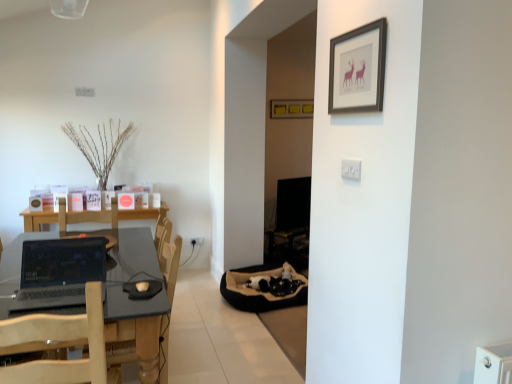
Identify the location of wooden armchair at center. The image size is (512, 384). (140, 345).

What do you see at coordinates (358, 69) in the screenshot? The width and height of the screenshot is (512, 384). I see `matte black picture frame at upper center, the 2th picture frame viewed from the top` at bounding box center [358, 69].

The image size is (512, 384). What do you see at coordinates (59, 272) in the screenshot?
I see `black glossy laptop at left` at bounding box center [59, 272].

The width and height of the screenshot is (512, 384). Describe the element at coordinates (293, 204) in the screenshot. I see `black glossy monitor at center` at that location.

This screenshot has height=384, width=512. Find the location of `wooden armchair at center`. wooden armchair at center is located at coordinates (x=140, y=345).

Consider the image. How many degrees apart are the facing directions of wooden armchair at center and wooden chair at left?

The angle between the facing direction of wooden armchair at center and the facing direction of wooden chair at left is 95.2 degrees.

From the image's perspective, which one is positioned lower, wooden armchair at center or wooden chair at left?

wooden armchair at center appears lower in the image.

Can you confirm if wooden armchair at center is thinner than wooden chair at left?

Incorrect, the width of wooden armchair at center is not less than that of wooden chair at left.

Which object is positioned more to the left, wooden chair at left or black glossy monitor at center?

From the viewer's perspective, wooden chair at left appears more on the left side.

Based on their sizes in the image, would you say wooden chair at left is bigger or smaller than black glossy monitor at center?

wooden chair at left is bigger than black glossy monitor at center.

Locate an element on the screen. This screenshot has width=512, height=384. computer monitor located on the right of wooden chair at left is located at coordinates (293, 204).

Considering the sizes of black glossy laptop at left and matte yellow picture frame at center, arranged as the second picture frame when ordered from the bottom, in the image, is black glossy laptop at left wider or thinner than matte yellow picture frame at center, arranged as the second picture frame when ordered from the bottom,?

Considering their sizes, black glossy laptop at left looks broader than matte yellow picture frame at center, arranged as the second picture frame when ordered from the bottom.

Consider the image. Is black glossy laptop at left positioned with its back to matte yellow picture frame at center, arranged as the second picture frame when ordered from the bottom?

No.

How different are the orientations of black glossy laptop at left and matte yellow picture frame at center, the 1th picture frame viewed from the top, in degrees?

black glossy laptop at left and matte yellow picture frame at center, the 1th picture frame viewed from the top, are facing 3.95 degrees away from each other.

From a real-world perspective, does black glossy laptop at left stand above matte yellow picture frame at center, the 1th picture frame viewed from the top?

No.

Relative to dark gray laminate table at left, is black glossy monitor at center in front or behind?

Clearly, black glossy monitor at center is behind dark gray laminate table at left.

Where is `computer monitor behind the dark gray laminate table at left`? computer monitor behind the dark gray laminate table at left is located at coordinates (293, 204).

Is black glossy monitor at center facing away from dark gray laminate table at left?

No.

Is point (166, 370) behind point (349, 179)?

That is True.

Based on the photo, which object is wider, wooden armchair at center or white plastic electric outlet at upper center, placed as the second electric outlet when sorted from left to right?

Wider between the two is wooden armchair at center.

Can you confirm if wooden armchair at center is taller than white plastic electric outlet at upper center, the first electric outlet when ordered from front to back?

Yes.

Which is behind, black glossy monitor at center or wooden armchair at center?

black glossy monitor at center is further from the camera.

Between black glossy monitor at center and wooden armchair at center, which one has smaller width?

Thinner between the two is black glossy monitor at center.

Can you confirm if black glossy monitor at center is smaller than wooden armchair at center?

Indeed, black glossy monitor at center has a smaller size compared to wooden armchair at center.

Locate an element on the screen. The width and height of the screenshot is (512, 384). armchair below the black glossy monitor at center (from a real-world perspective) is located at coordinates (140, 345).

Does dark gray laminate table at left turn towards black glossy monitor at center?

No.

Locate an element on the screen. The width and height of the screenshot is (512, 384). table on the left of black glossy monitor at center is located at coordinates (136, 304).

From the image's perspective, between dark gray laminate table at left and black glossy monitor at center, which one is located above?

black glossy monitor at center.

Considering the relative sizes of dark gray laminate table at left and black glossy monitor at center in the image provided, is dark gray laminate table at left wider than black glossy monitor at center?

Yes, dark gray laminate table at left is wider than black glossy monitor at center.

Where is `chair that appears above the wooden armchair at center (from a real-world perspective)`? This screenshot has width=512, height=384. chair that appears above the wooden armchair at center (from a real-world perspective) is located at coordinates (60, 341).

Identify the location of computer monitor on the right of wooden chair at left. This screenshot has width=512, height=384. (293, 204).

Estimate the real-world distances between objects in this image. Which object is closer to white plastic electric outlet at upper center, which ranks as the first electric outlet in right-to-left order, white plastic electric outlet at center, acting as the 2th electric outlet starting from the top, or matte yellow picture frame at center, arranged as the second picture frame when ordered from the bottom?

Among the two, white plastic electric outlet at center, acting as the 2th electric outlet starting from the top, is located nearer to white plastic electric outlet at upper center, which ranks as the first electric outlet in right-to-left order.

Looking at the image, which one is located closer to black glossy laptop at left, white plastic electric outlet at upper center, which ranks as the second electric outlet in back-to-front order, or matte black picture frame at upper center, the 1th picture frame ordered from the bottom?

Based on the image, white plastic electric outlet at upper center, which ranks as the second electric outlet in back-to-front order, appears to be nearer to black glossy laptop at left.

Which object lies nearer to the anchor point wooden chair at left, white plastic electric outlet at upper center, which ranks as the second electric outlet in back-to-front order, or matte black picture frame at upper center, arranged as the first picture frame when viewed from the front?

Based on the image, white plastic electric outlet at upper center, which ranks as the second electric outlet in back-to-front order, appears to be nearer to wooden chair at left.

Which object lies nearer to the anchor point dark gray laminate table at left, matte yellow picture frame at center, arranged as the 2th picture frame when viewed from the front, or white plastic electric outlet at upper center, marked as the 1th electric outlet in a top-to-bottom arrangement?

Based on the image, white plastic electric outlet at upper center, marked as the 1th electric outlet in a top-to-bottom arrangement, appears to be nearer to dark gray laminate table at left.

From the image, which object appears to be nearer to matte black picture frame at upper center, arranged as the second picture frame when viewed from the back, wooden armchair at center or white plastic electric outlet at center, placed as the 1th electric outlet when sorted from bottom to top?

Among the two, wooden armchair at center is located nearer to matte black picture frame at upper center, arranged as the second picture frame when viewed from the back.

When comparing their distances from white plastic electric outlet at upper center, the first electric outlet when ordered from front to back, does matte yellow picture frame at center, the 1th picture frame viewed from the top, or black glossy laptop at left seem further?

The object further to white plastic electric outlet at upper center, the first electric outlet when ordered from front to back, is matte yellow picture frame at center, the 1th picture frame viewed from the top.

From the image, which object appears to be farther from matte black picture frame at upper center, the 1th picture frame ordered from the bottom, white plastic electric outlet at upper center, which ranks as the second electric outlet in back-to-front order, or wooden armchair at center?

Among the two, wooden armchair at center is located further to matte black picture frame at upper center, the 1th picture frame ordered from the bottom.

Looking at this image, from the image, which object appears to be farther from wooden armchair at center, black glossy laptop at left or black glossy monitor at center?

black glossy monitor at center is further to wooden armchair at center.

This screenshot has width=512, height=384. I want to click on electric outlet located between wooden chair at left and white plastic electric outlet at center, which is the second electric outlet in right-to-left order, in the depth direction, so click(x=351, y=169).

The height and width of the screenshot is (384, 512). In order to click on armchair between dark gray laminate table at left and white plastic electric outlet at upper center, marked as the 2th electric outlet in a bottom-to-top arrangement, in the horizontal direction in this screenshot , I will do `click(140, 345)`.

Where is `armchair between white plastic electric outlet at upper center, placed as the second electric outlet when sorted from left to right, and black glossy monitor at center, along the z-axis`? This screenshot has height=384, width=512. armchair between white plastic electric outlet at upper center, placed as the second electric outlet when sorted from left to right, and black glossy monitor at center, along the z-axis is located at coordinates (140, 345).

You are a GUI agent. You are given a task and a screenshot of the screen. Output one action in this format:
    pyautogui.click(x=<x>, y=<y>)
    Task: Click on the armchair between dark gray laminate table at left and matte yellow picture frame at center, acting as the first picture frame starting from the back, in the front-back direction
    
    Given the screenshot: What is the action you would take?
    pyautogui.click(x=140, y=345)